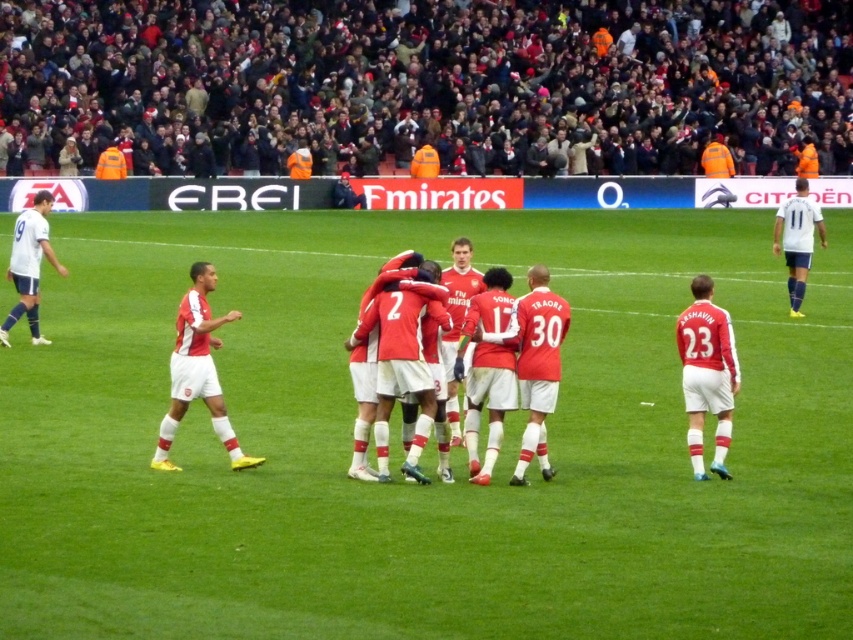
Can you confirm if matte white shorts at left is positioned to the left of white matte jersey at left?

No, matte white shorts at left is not to the left of white matte jersey at left.

Does matte white shorts at left appear under white matte jersey at left?

Yes, matte white shorts at left is below white matte jersey at left.

Is point (235, 310) positioned in front of point (44, 220)?

Yes, it is in front of point (44, 220).

Locate an element on the screen. This screenshot has width=853, height=640. matte white shorts at left is located at coordinates (196, 371).

Which is below, dark gray fabric crowd at upper center or matte white shorts at left?

matte white shorts at left is below.

Does dark gray fabric crowd at upper center have a larger size compared to matte white shorts at left?

Yes, dark gray fabric crowd at upper center is bigger than matte white shorts at left.

The height and width of the screenshot is (640, 853). I want to click on dark gray fabric crowd at upper center, so click(426, 83).

Can you confirm if green grass football field at center is shorter than white smooth soccer player at right?

No, green grass football field at center is not shorter than white smooth soccer player at right.

Which is in front, point (695, 570) or point (820, 216)?

Point (695, 570) is in front.

The width and height of the screenshot is (853, 640). What are the coordinates of `green grass football field at center` in the screenshot? It's located at (428, 445).